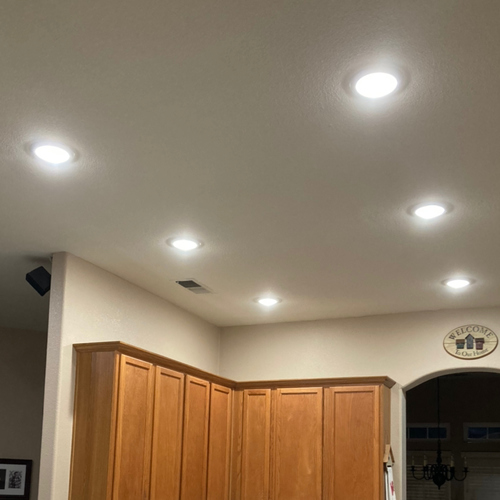
Where is `picture wall frame`? This screenshot has height=500, width=500. picture wall frame is located at coordinates (12, 485).